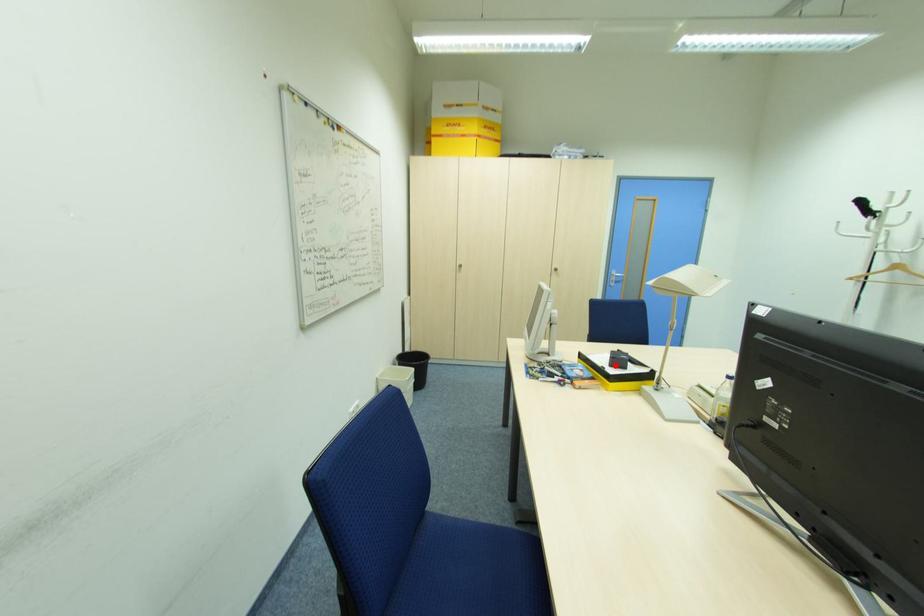
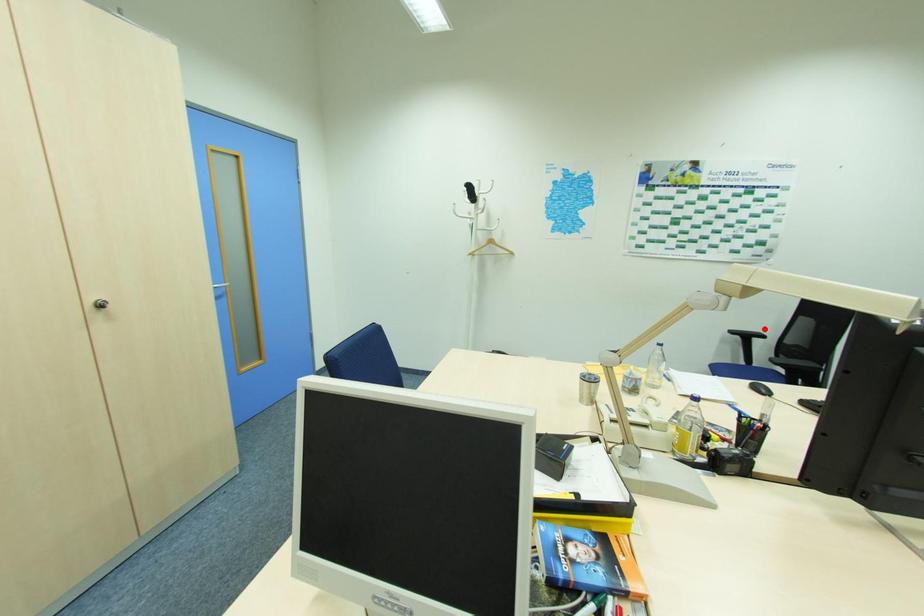
I am providing you with two images of the same scene from different viewpoints. A red point is marked on the first image and another point is marked on the second image. Is the marked point in image1 the same physical position as the marked point in image2?

No